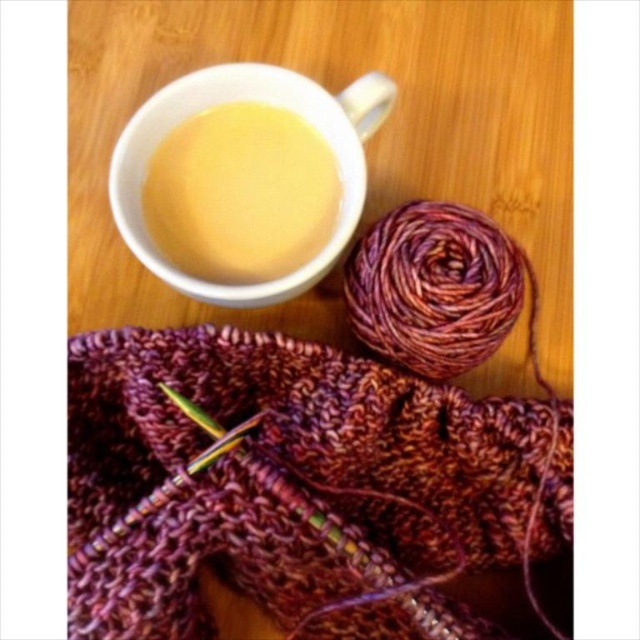
Which is in front, point (170, 474) or point (300, 260)?

Positioned in front is point (170, 474).

Can you confirm if knitted wool scarf at center is shorter than yellow matte mug at upper center?

No.

The width and height of the screenshot is (640, 640). What do you see at coordinates (276, 477) in the screenshot?
I see `knitted wool scarf at center` at bounding box center [276, 477].

Where is `knitted wool scarf at center`? This screenshot has height=640, width=640. knitted wool scarf at center is located at coordinates coord(276,477).